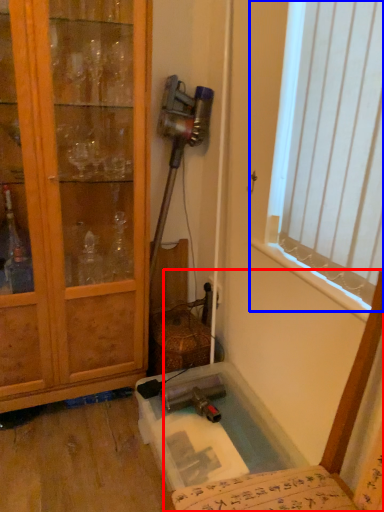
Question: Which point is closer to the camera, chair (highlighted by a red box) or window (highlighted by a blue box)?

Choices:
 (A) chair
 (B) window

Answer: (A)